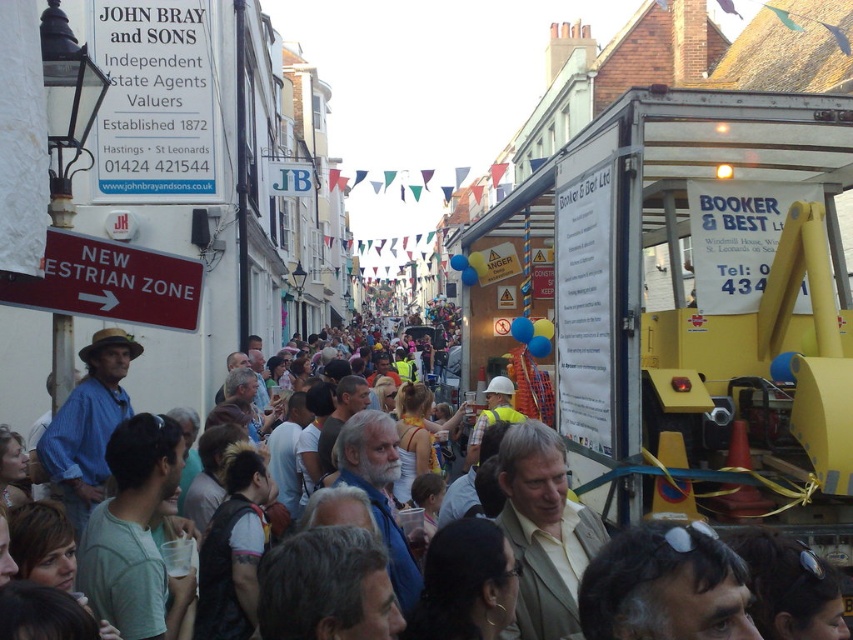
Can you confirm if yellow plastic construction equipment at center is thinner than multicolored fabric crowd at center?

Correct, yellow plastic construction equipment at center's width is less than multicolored fabric crowd at center's.

Does yellow plastic construction equipment at center appear under multicolored fabric crowd at center?

No, yellow plastic construction equipment at center is not below multicolored fabric crowd at center.

Which is behind, point (618, 244) or point (512, 458)?

Positioned behind is point (512, 458).

Where is `yellow plastic construction equipment at center`? The width and height of the screenshot is (853, 640). yellow plastic construction equipment at center is located at coordinates (692, 305).